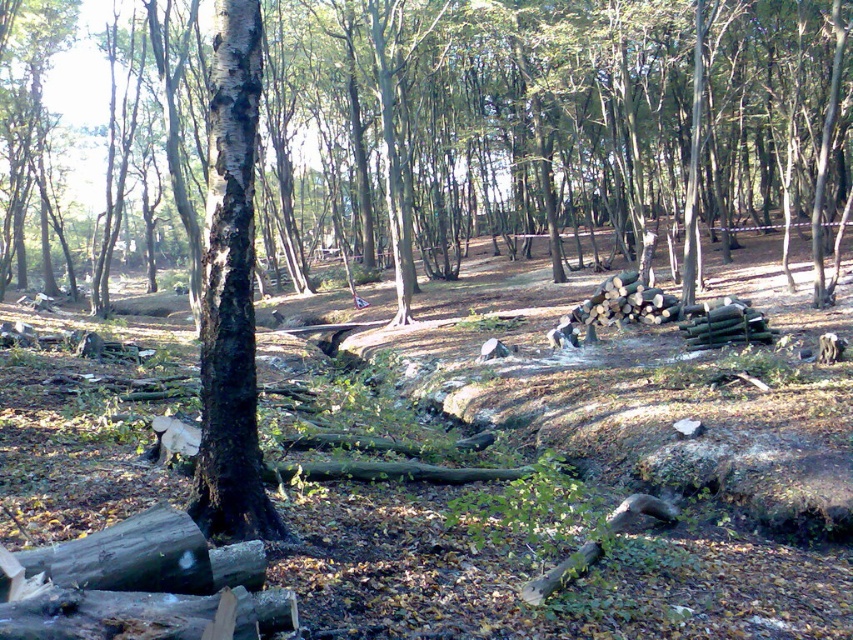
Which is above, brown rough bark tree at center or black rough bark tree at center?

brown rough bark tree at center

Between brown rough bark tree at center and black rough bark tree at center, which one has less height?

black rough bark tree at center

You are a GUI agent. You are given a task and a screenshot of the screen. Output one action in this format:
    pyautogui.click(x=<x>, y=<y>)
    Task: Click on the brown rough bark tree at center
    The width and height of the screenshot is (853, 640).
    Given the screenshot: What is the action you would take?
    pyautogui.click(x=552, y=132)

Find the location of a particular element. The height and width of the screenshot is (640, 853). brown rough bark tree at center is located at coordinates (552, 132).